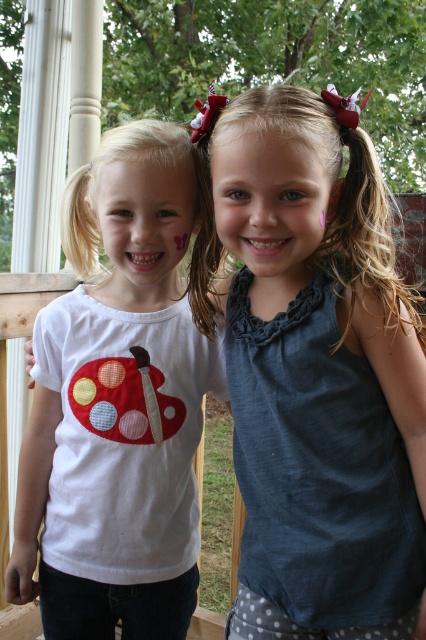
Question: Which object appears closest to the camera in this image?

Choices:
 (A) white matte shirt with ladybug design at left
 (B) blue fabric shirt at center

Answer: (B)

Question: Can you confirm if blue fabric shirt at center is wider than white matte shirt with ladybug design at left?

Choices:
 (A) no
 (B) yes

Answer: (A)

Question: Does blue fabric shirt at center appear over white matte shirt with ladybug design at left?

Choices:
 (A) no
 (B) yes

Answer: (B)

Question: Can you confirm if blue fabric shirt at center is positioned to the right of white matte shirt with ladybug design at left?

Choices:
 (A) no
 (B) yes

Answer: (B)

Question: Among these objects, which one is farthest from the camera?

Choices:
 (A) white matte shirt with ladybug design at left
 (B) blue fabric shirt at center

Answer: (A)